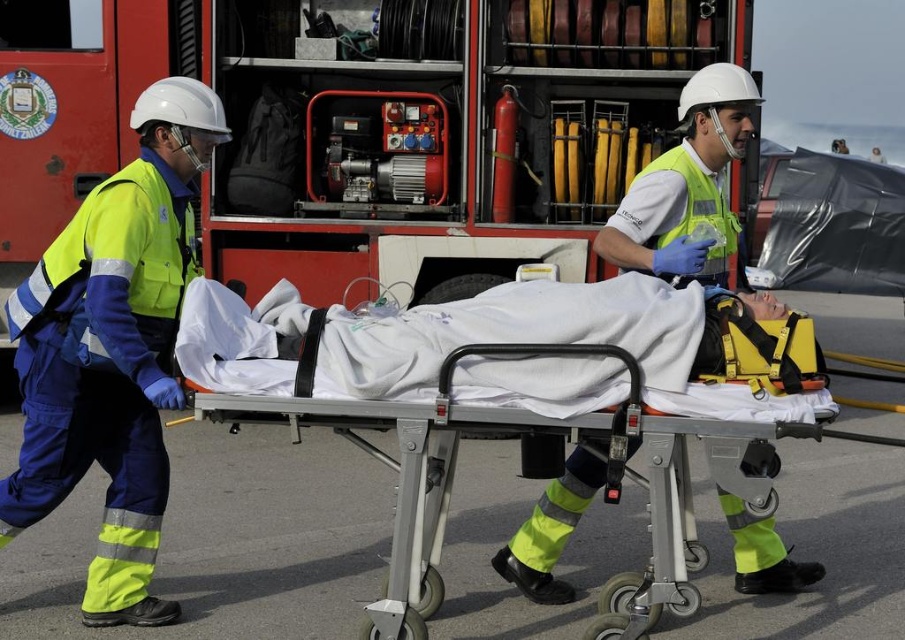
You are a photographer taking a picture of the emergency responders and the stretcher. You want to ensure both the yellow reflective uniform at left and the white fabric stretcher at center are clearly visible. Which object should you focus on first if you want to capture the thinner one in sharp detail?

The yellow reflective uniform at left is thinner than the white fabric stretcher at center, so you should focus on the yellow reflective uniform at left first to capture its thinner details clearly.

You are an emergency responder carrying a patient on a stretcher. You need to pass through a narrow doorway that is 32 inches wide. The yellow reflective uniform at left and white fabric stretcher at center are part of your team. Can you fit through the doorway with the stretcher?

The yellow reflective uniform at left and white fabric stretcher at center are 31.13 inches apart from each other. Since the doorway is 32 inches wide, there is 0.87 inches of clearance, so it is possible to fit through the doorway with the stretcher.

You are a photographer trying to capture a clear image of both the yellow reflective uniform at left and the white fabric stretcher at center. Given their sizes, which object should you focus on first to ensure it appears sharp in the photo?

The yellow reflective uniform at left is larger than the white fabric stretcher at center, so you should focus on the yellow reflective uniform at left first to ensure it appears sharp in the photo.